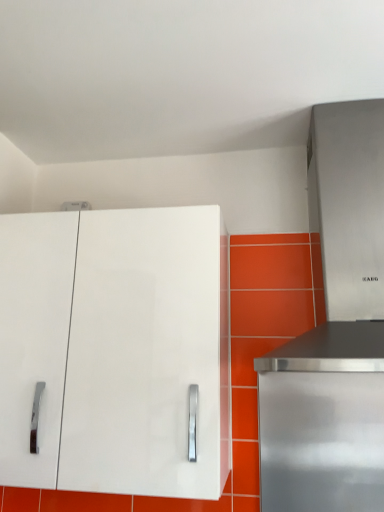
Question: In terms of height, does stainless steel range hood at upper right look taller or shorter compared to white glossy cabinet at upper left?

Choices:
 (A) short
 (B) tall

Answer: (B)

Question: From the image's perspective, is stainless steel range hood at upper right positioned above or below white glossy cabinet at upper left?

Choices:
 (A) above
 (B) below

Answer: (A)

Question: Which is farther from the stainless steel range hood at right?

Choices:
 (A) white glossy cabinet at upper left
 (B) stainless steel range hood at upper right

Answer: (A)

Question: Which object is positioned closest to the stainless steel range hood at right?

Choices:
 (A) stainless steel range hood at upper right
 (B) white glossy cabinet at upper left

Answer: (A)